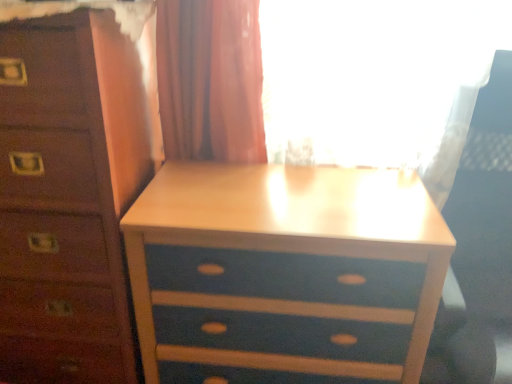
Question: Is blue painted wood chest of drawers at center shorter than blue painted wood nightstand at center?

Choices:
 (A) yes
 (B) no

Answer: (B)

Question: Is blue painted wood chest of drawers at center positioned with its back to blue painted wood nightstand at center?

Choices:
 (A) yes
 (B) no

Answer: (B)

Question: Is blue painted wood chest of drawers at center at the left side of blue painted wood nightstand at center?

Choices:
 (A) yes
 (B) no

Answer: (A)

Question: From the image's perspective, is blue painted wood chest of drawers at center beneath blue painted wood nightstand at center?

Choices:
 (A) no
 (B) yes

Answer: (A)

Question: Can blue painted wood nightstand at center be found inside blue painted wood chest of drawers at center?

Choices:
 (A) no
 (B) yes

Answer: (A)

Question: From a real-world perspective, is blue painted wood chest of drawers at center physically above blue painted wood nightstand at center?

Choices:
 (A) yes
 (B) no

Answer: (A)

Question: Does blue painted wood chest of drawers at center have a lesser height compared to white plastic swivel chair at right?

Choices:
 (A) no
 (B) yes

Answer: (A)

Question: From the image's perspective, would you say blue painted wood chest of drawers at center is positioned over white plastic swivel chair at right?

Choices:
 (A) no
 (B) yes

Answer: (B)

Question: Does blue painted wood chest of drawers at center have a larger size compared to white plastic swivel chair at right?

Choices:
 (A) yes
 (B) no

Answer: (A)

Question: Considering the relative positions of blue painted wood chest of drawers at center and white plastic swivel chair at right in the image provided, is blue painted wood chest of drawers at center to the right of white plastic swivel chair at right from the viewer's perspective?

Choices:
 (A) no
 (B) yes

Answer: (A)

Question: Is blue painted wood chest of drawers at center not inside white plastic swivel chair at right?

Choices:
 (A) yes
 (B) no

Answer: (A)

Question: Can you confirm if blue painted wood chest of drawers at center is positioned to the left of white plastic swivel chair at right?

Choices:
 (A) yes
 (B) no

Answer: (A)

Question: Considering the relative positions of blue painted wood nightstand at center and white plastic swivel chair at right in the image provided, is blue painted wood nightstand at center in front of white plastic swivel chair at right?

Choices:
 (A) no
 (B) yes

Answer: (A)